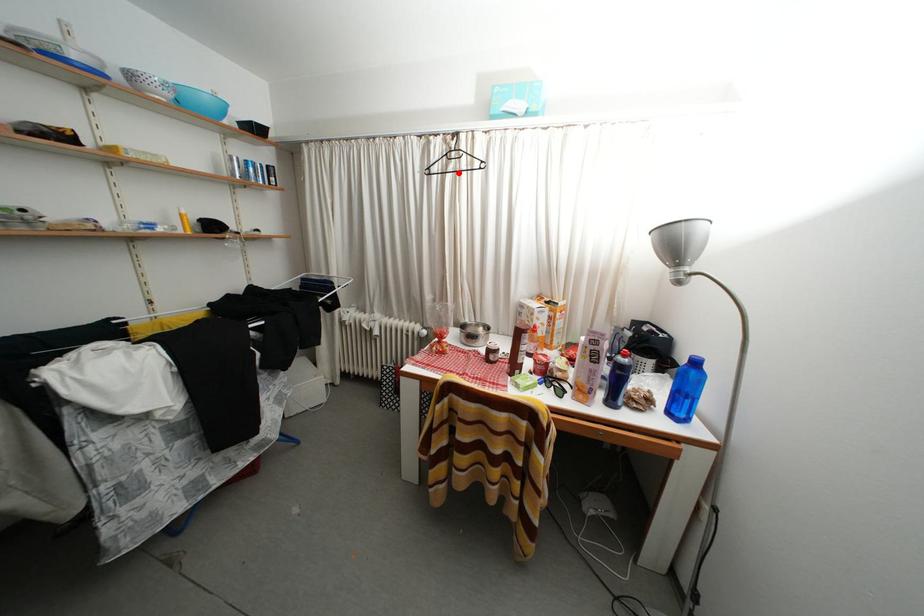
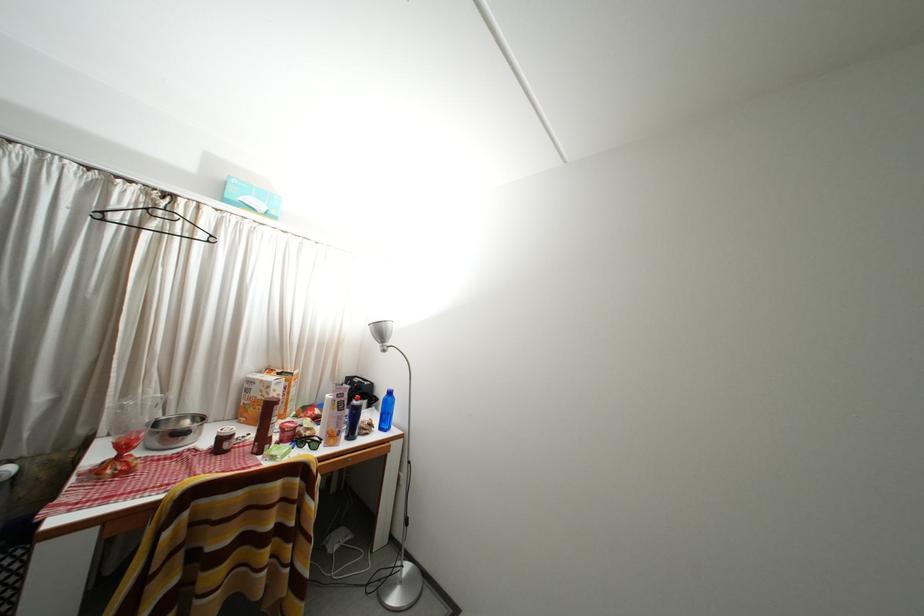
Question: I am providing you with two images of the same scene from different viewpoints. Image1 has a red point marked. In image2, the corresponding 3D location appears at what relative position? Reply with the corresponding letter.

Choices:
 (A) Closer
 (B) Farther

Answer: (B)